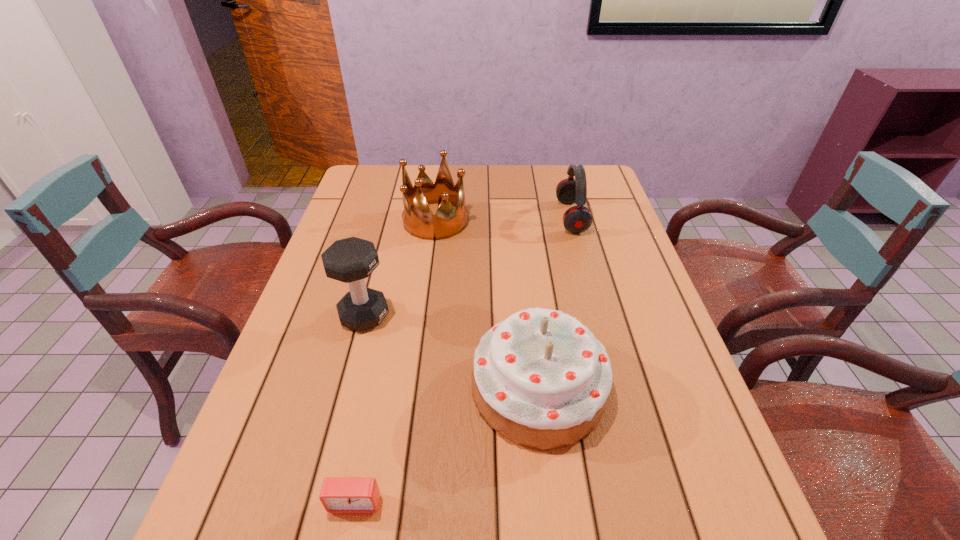
Locate an element on the screen. The width and height of the screenshot is (960, 540). object that ranks as the closest to the earphone is located at coordinates (418, 220).

The image size is (960, 540). In order to click on object identified as the fourth closest to the earphone in this screenshot , I will do `click(338, 494)`.

Where is `vacant region that satisfies the following two spatial constraints: 1. on the ear cups of the earphone; 2. on the front-facing side of the alarm clock`? The height and width of the screenshot is (540, 960). vacant region that satisfies the following two spatial constraints: 1. on the ear cups of the earphone; 2. on the front-facing side of the alarm clock is located at coordinates (648, 502).

The height and width of the screenshot is (540, 960). In order to click on vacant position in the image that satisfies the following two spatial constraints: 1. on the ear cups of the earphone; 2. on the front-facing side of the nearest object in this screenshot , I will do `click(648, 502)`.